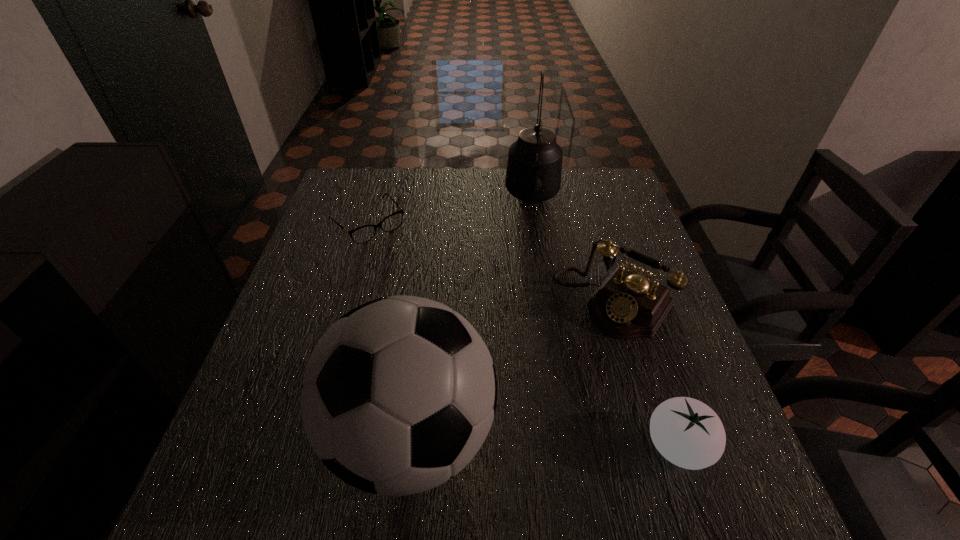
Locate an element on the screen. Image resolution: width=960 pixels, height=540 pixels. tomato situated at the near edge is located at coordinates (688, 433).

Locate an element on the screen. This screenshot has width=960, height=540. object that is at the left edge is located at coordinates (363, 234).

Find the location of a particular element. tomato situated at the right edge is located at coordinates (688, 433).

What are the coordinates of `telephone located in the right edge section of the desktop` in the screenshot? It's located at (627, 305).

You are a GUI agent. You are given a task and a screenshot of the screen. Output one action in this format:
    pyautogui.click(x=<x>, y=<y>)
    Task: Click on the object situated at the far left corner
    This screenshot has height=540, width=960.
    Given the screenshot: What is the action you would take?
    pyautogui.click(x=363, y=234)

Locate an element on the screen. This screenshot has width=960, height=540. object positioned at the near right corner is located at coordinates (688, 433).

The height and width of the screenshot is (540, 960). Find the location of `vacant space at the far edge of the desktop`. vacant space at the far edge of the desktop is located at coordinates (424, 195).

Image resolution: width=960 pixels, height=540 pixels. I want to click on vacant space at the near edge of the desktop, so click(x=617, y=421).

Find the location of a particular element. The image size is (960, 540). free space at the left edge of the desktop is located at coordinates (329, 326).

You are a GUI agent. You are given a task and a screenshot of the screen. Output one action in this format:
    pyautogui.click(x=<x>, y=<y>)
    Task: Click on the free location at the right edge
    
    Given the screenshot: What is the action you would take?
    pyautogui.click(x=676, y=327)